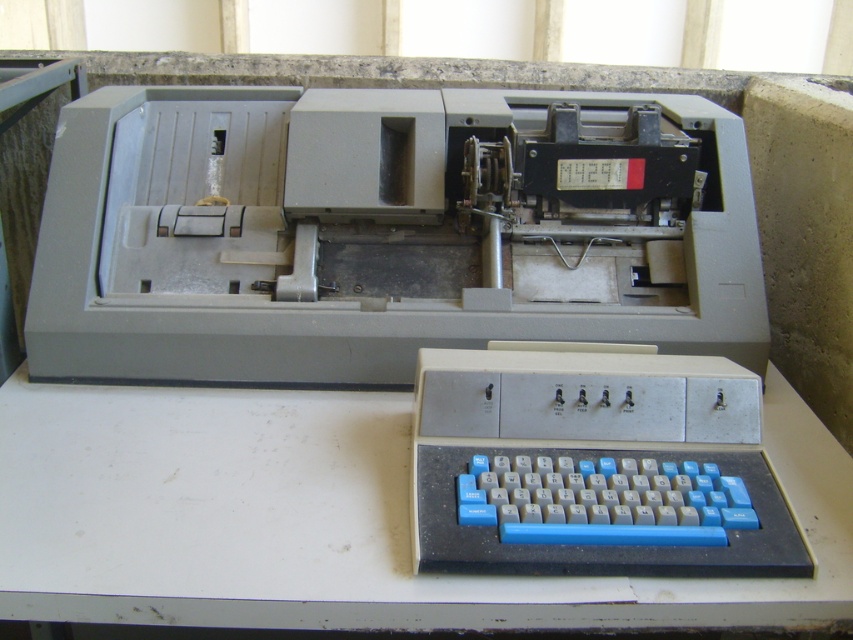
Based on the photo, you are setting up a display for a vintage typewriter exhibit. You need to place a label next to the gray plastic register at center and the blue plastic keyboard at lower center. According to the image, which object should the label for the register be placed to the left of?

The gray plastic register at center is to the left of the blue plastic keyboard at lower center, so the label for the register should be placed to the left of the blue plastic keyboard at lower center.

You are a technician examining the typewriter and need to access both the point at (459, 216) and the point at (677, 476). Which point should you reach for first to minimize the distance traveled?

You should reach for point (459, 216) first because it is closer to you than point (677, 476), so accessing it first reduces the total distance traveled.

You are setting up a desk organizer and need to place the gray plastic register at center and the blue plastic keyboard at lower center. Given their height differences, which object should be placed on the lower shelf to ensure stability?

The gray plastic register at center has a greater height compared to the blue plastic keyboard at lower center. To ensure stability, the taller gray plastic register at center should be placed on the lower shelf, while the shorter blue plastic keyboard at lower center can be placed on the upper shelf.